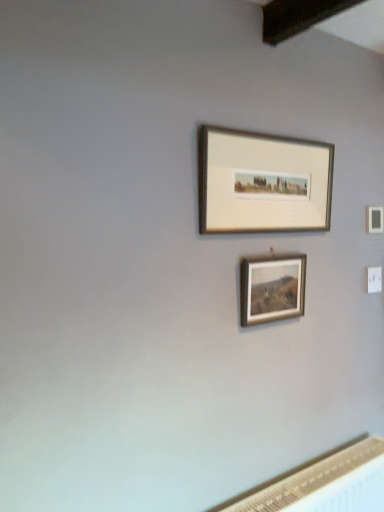
Question: Is white textured radiator at lower right taller or shorter than wooden frame at center, the 1th picture frame from the bottom?

Choices:
 (A) short
 (B) tall

Answer: (B)

Question: From a real-world perspective, is white textured radiator at lower right physically located above or below wooden frame at center, the 2th picture frame positioned from the top?

Choices:
 (A) below
 (B) above

Answer: (A)

Question: Which of these objects is positioned farthest from the silver metallic picture frame at upper center, which ranks as the second picture frame in bottom-to-top order?

Choices:
 (A) white textured radiator at lower right
 (B) wooden frame at center, the 1th picture frame from the bottom

Answer: (A)

Question: Considering the real-world distances, which object is closest to the silver metallic picture frame at upper center, the first picture frame from the top?

Choices:
 (A) wooden frame at center, the 2th picture frame positioned from the top
 (B) white textured radiator at lower right

Answer: (A)